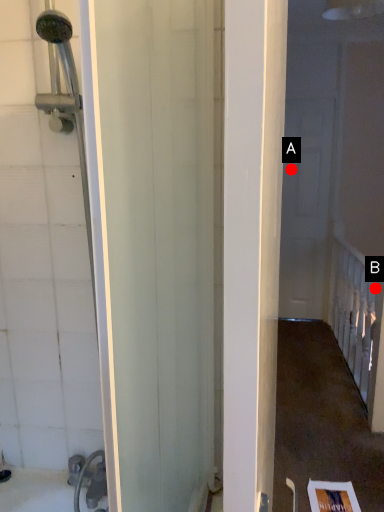
Question: Two points are circled on the image, labeled by A and B beside each circle. Which of the following is the closest to the observer?

Choices:
 (A) A is closer
 (B) B is closer

Answer: (B)